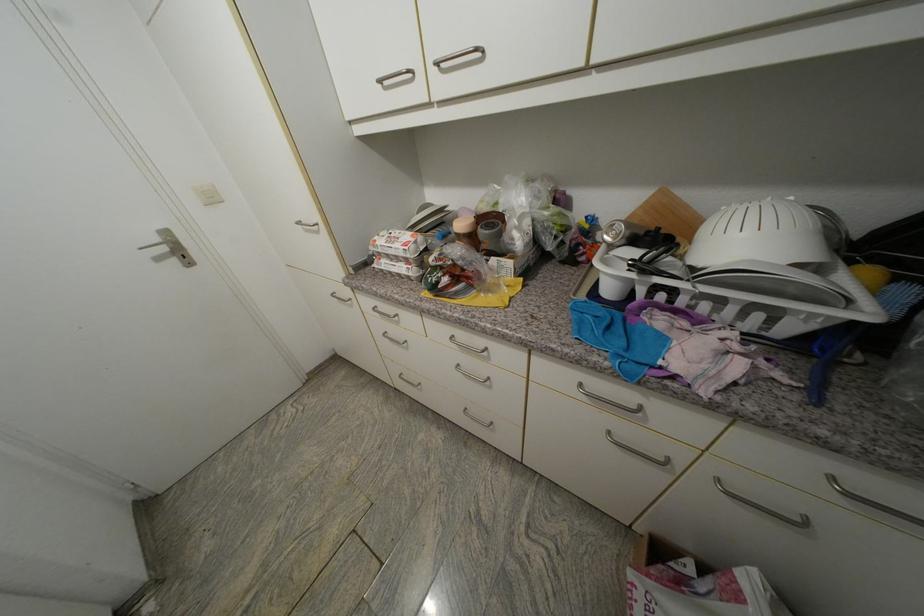
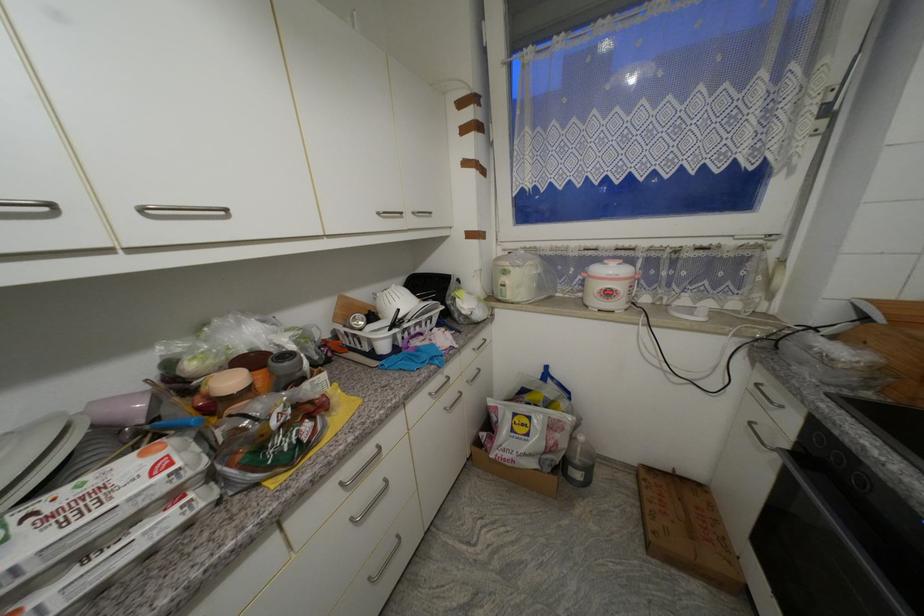
Find the pixel in the second image that matches (411,262) in the first image.

(178, 498)